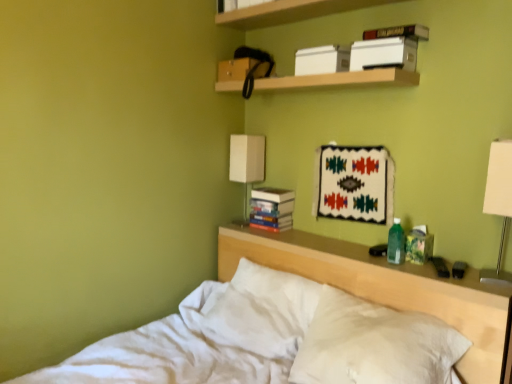
Question: Is white cotton bed at center at the back of wooden shelf at upper center, the first shelf when ordered from top to bottom?

Choices:
 (A) no
 (B) yes

Answer: (A)

Question: Can you confirm if wooden shelf at upper center, which is the 2th shelf from bottom to top, is positioned to the left of white cotton bed at center?

Choices:
 (A) yes
 (B) no

Answer: (B)

Question: Is wooden shelf at upper center, which is the 2th shelf from bottom to top, positioned behind white cotton bed at center?

Choices:
 (A) yes
 (B) no

Answer: (A)

Question: Considering the relative sizes of wooden shelf at upper center, the first shelf when ordered from top to bottom, and white cotton bed at center in the image provided, is wooden shelf at upper center, the first shelf when ordered from top to bottom, shorter than white cotton bed at center?

Choices:
 (A) yes
 (B) no

Answer: (A)

Question: Is wooden shelf at upper center, which is the 2th shelf from bottom to top, completely or partially outside of white cotton bed at center?

Choices:
 (A) no
 (B) yes

Answer: (B)

Question: Based on their positions, is hardcover book at upper center, acting as the 1th paperback book starting from the front, located to the left or right of white plastic lamp at right?

Choices:
 (A) right
 (B) left

Answer: (B)

Question: Looking at the image, does hardcover book at upper center, positioned as the third paperback book in back-to-front order, seem bigger or smaller compared to white plastic lamp at right?

Choices:
 (A) small
 (B) big

Answer: (B)

Question: From their relative heights in the image, would you say hardcover book at upper center, positioned as the third paperback book in back-to-front order, is taller or shorter than white plastic lamp at right?

Choices:
 (A) short
 (B) tall

Answer: (A)

Question: Looking at their shapes, would you say hardcover book at upper center, the 2th paperback book from the right, is wider or thinner than white plastic lamp at right?

Choices:
 (A) wide
 (B) thin

Answer: (A)

Question: From the image's perspective, is wooden shelf at upper center, which ranks as the second shelf in top-to-bottom order, located above or below white plastic lamp at right?

Choices:
 (A) below
 (B) above

Answer: (B)

Question: In terms of size, does wooden shelf at upper center, which ranks as the second shelf in top-to-bottom order, appear bigger or smaller than white plastic lamp at right?

Choices:
 (A) small
 (B) big

Answer: (B)

Question: Is point (369, 72) closer or farther from the camera than point (497, 153)?

Choices:
 (A) closer
 (B) farther

Answer: (B)

Question: From a real-world perspective, relative to white plastic lamp at right, is wooden shelf at upper center, which ranks as the second shelf in top-to-bottom order, vertically above or below?

Choices:
 (A) below
 (B) above

Answer: (B)

Question: Is wooden shelf at upper center, which is the 2th shelf from bottom to top, bigger or smaller than hardcover book at upper center, acting as the 1th paperback book starting from the front?

Choices:
 (A) big
 (B) small

Answer: (A)

Question: Considering the positions of wooden shelf at upper center, the first shelf when ordered from top to bottom, and hardcover book at upper center, positioned as the second paperback book in left-to-right order, in the image, is wooden shelf at upper center, the first shelf when ordered from top to bottom, wider or thinner than hardcover book at upper center, positioned as the second paperback book in left-to-right order,?

Choices:
 (A) wide
 (B) thin

Answer: (A)